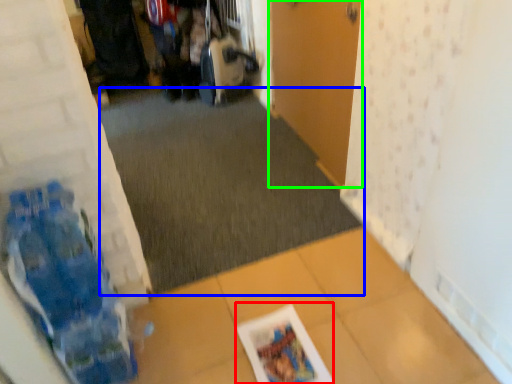
Question: Estimate the real-world distances between objects in this image. Which object is closer to magazine (highlighted by a red box), plain (highlighted by a blue box) or door (highlighted by a green box)?

Choices:
 (A) plain
 (B) door

Answer: (A)